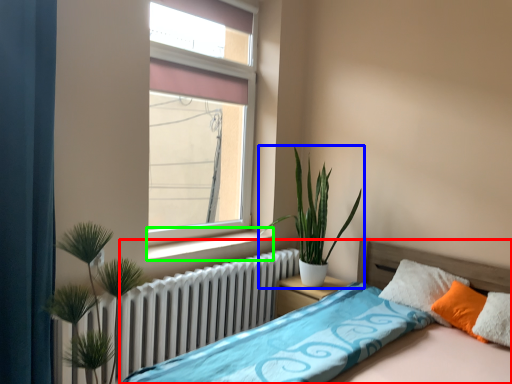
Question: Which object is positioned closest to bed (highlighted by a red box)? Select from houseplant (highlighted by a blue box) and window sill (highlighted by a green box).

Choices:
 (A) houseplant
 (B) window sill

Answer: (A)